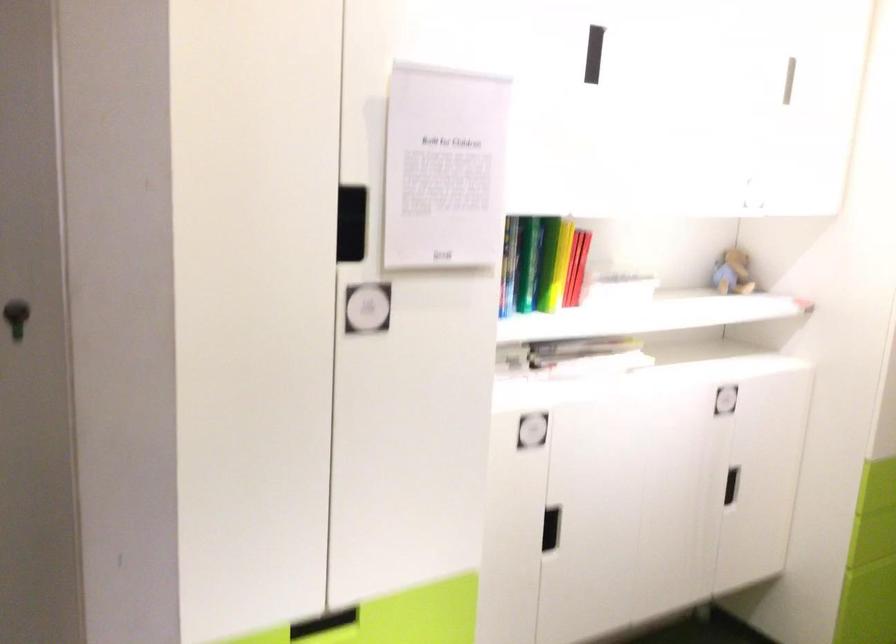
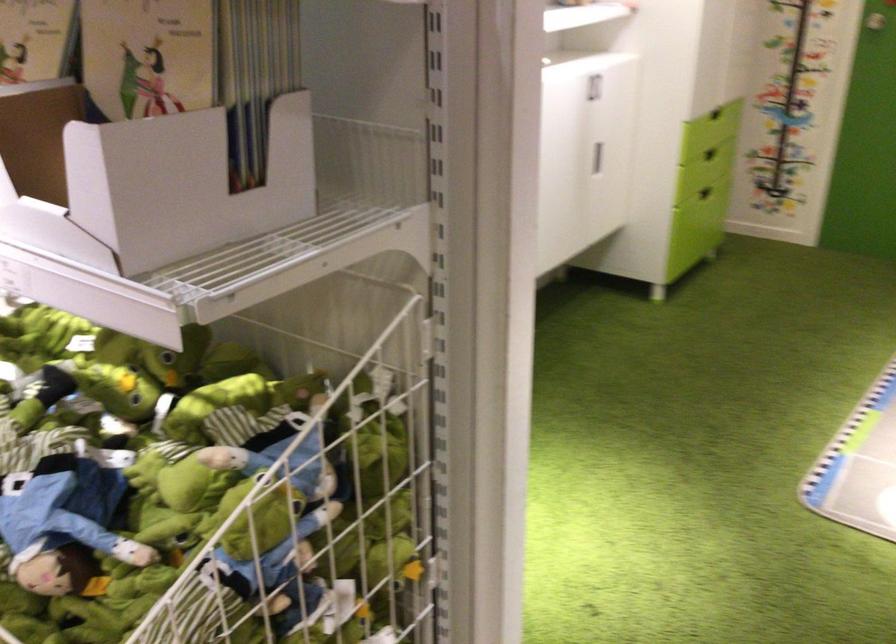
The point at (722,404) is marked in the first image. Where is the corresponding point in the second image?

(593, 87)